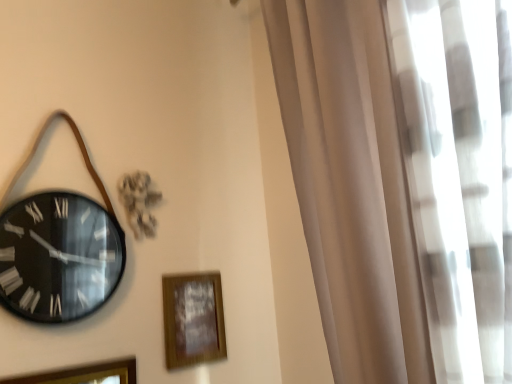
Question: From a real-world perspective, is black glass clock at left above or below wooden picture frame at lower center, which is the 2th picture frame in front-to-back order?

Choices:
 (A) above
 (B) below

Answer: (A)

Question: Is point click(x=41, y=231) closer or farther from the camera than point click(x=208, y=337)?

Choices:
 (A) farther
 (B) closer

Answer: (B)

Question: Which object is positioned farthest from the wooden picture frame at lower left, which ranks as the second picture frame in right-to-left order?

Choices:
 (A) white sheer curtain at right
 (B) black glass clock at left
 (C) wooden picture frame at lower center, which appears as the 2th picture frame when viewed from the left

Answer: (A)

Question: Which object is the farthest from the wooden picture frame at lower left, the second picture frame positioned from the back?

Choices:
 (A) black glass clock at left
 (B) wooden picture frame at lower center, marked as the first picture frame in a back-to-front arrangement
 (C) white sheer curtain at right

Answer: (C)